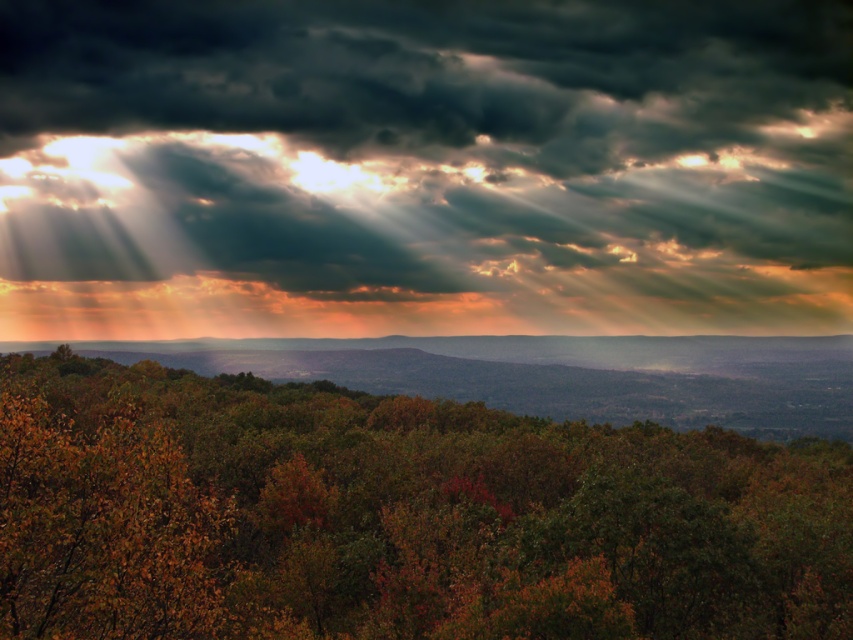
Question: Can you confirm if dark gray cloud at upper center is positioned above green matte tree at center?

Choices:
 (A) no
 (B) yes

Answer: (B)

Question: Does dark gray cloud at upper center have a greater width compared to green matte tree at center?

Choices:
 (A) yes
 (B) no

Answer: (A)

Question: Which point is farther to the camera?

Choices:
 (A) (402, 636)
 (B) (434, 132)

Answer: (B)

Question: Does dark gray cloud at upper center appear over green matte tree at center?

Choices:
 (A) yes
 (B) no

Answer: (A)